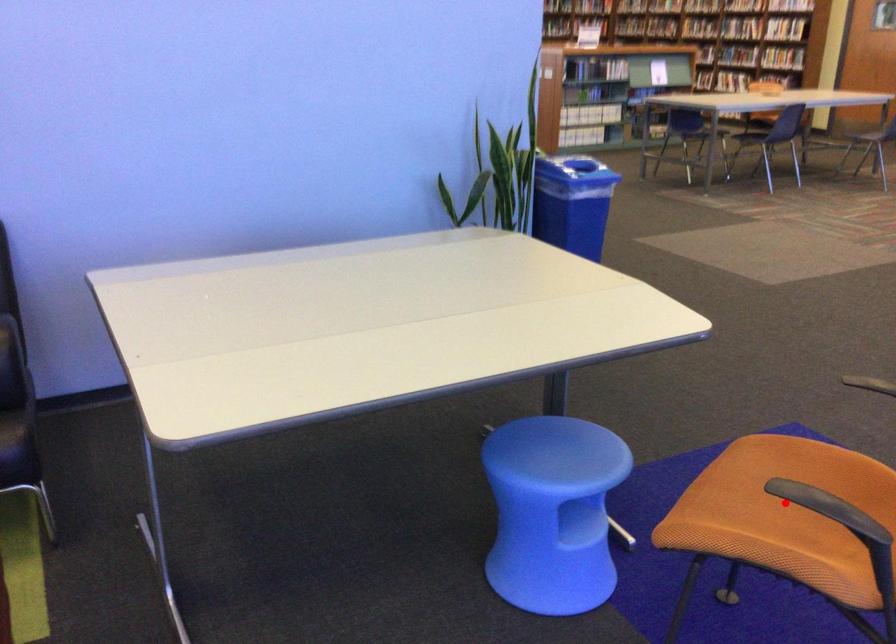
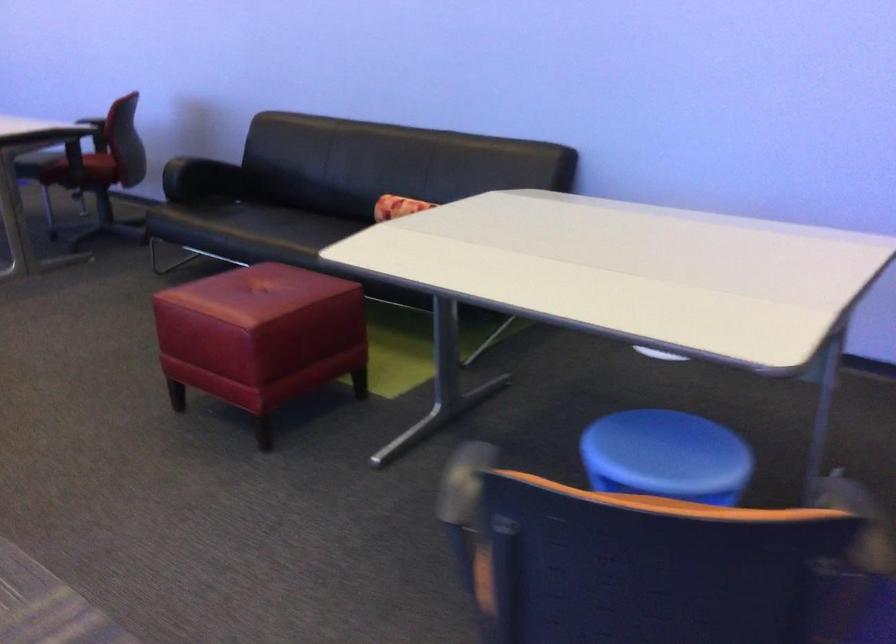
Question: I am providing you with two images of the same scene from different viewpoints. A red point is marked on the first image. Is the red point's position out of view in image 2?

Choices:
 (A) Yes
 (B) No

Answer: (A)